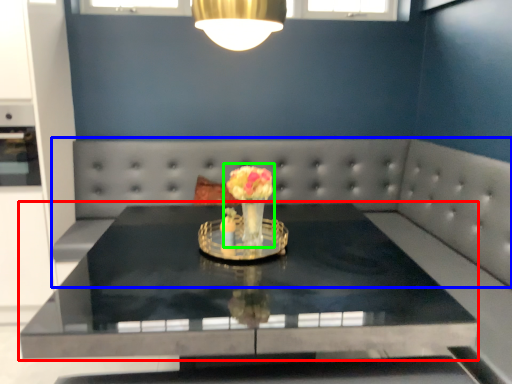
Question: Estimate the real-world distances between objects in this image. Which object is farther from table (highlighted by a red box), couch (highlighted by a blue box) or floral arrangement (highlighted by a green box)?

Choices:
 (A) couch
 (B) floral arrangement

Answer: (A)